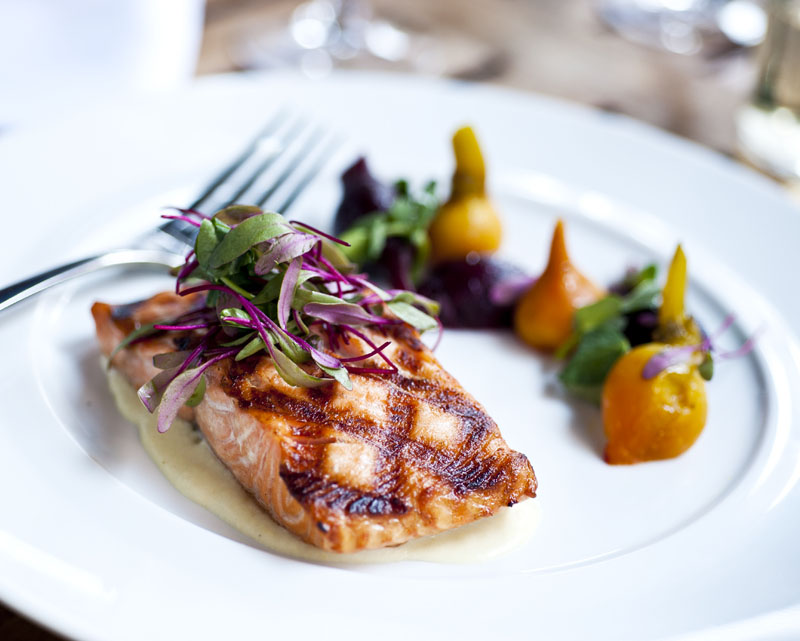
The width and height of the screenshot is (800, 641). Find the location of `dish`. dish is located at coordinates (474, 606).